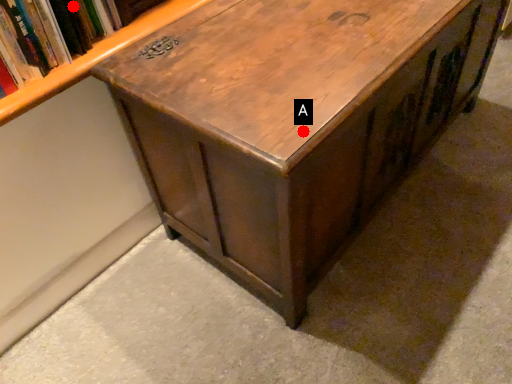
Question: Two points are circled on the image, labeled by A and B beside each circle. Which point is closer to the camera?

Choices:
 (A) A is closer
 (B) B is closer

Answer: (A)